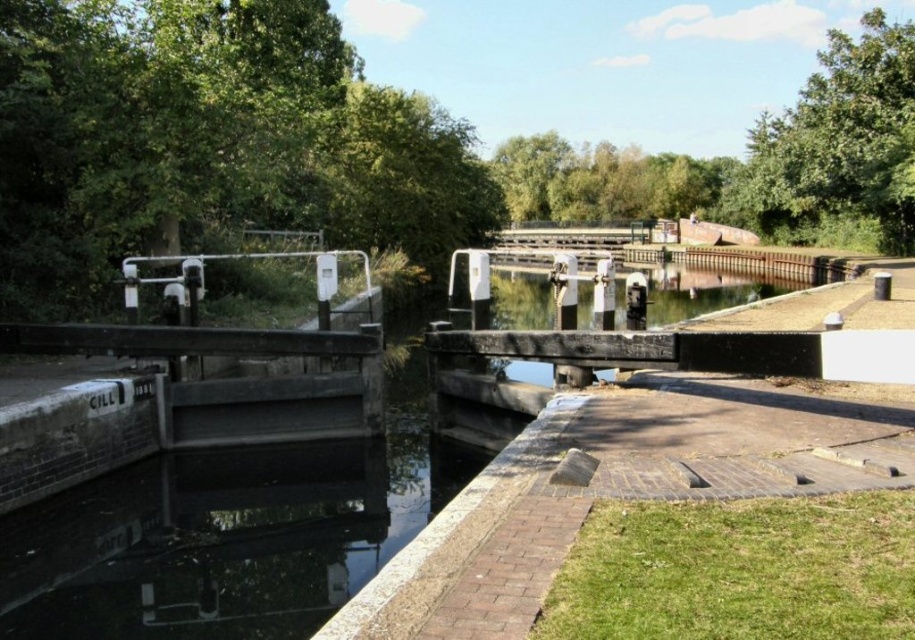
Image resolution: width=915 pixels, height=640 pixels. Identify the location of green leafy tree at upper left. (208, 141).

Which is in front, point (77, 292) or point (607, 193)?

Point (77, 292)

Is point (100, 51) farther from camera compared to point (494, 156)?

That is False.

Locate an element on the screen. This screenshot has width=915, height=640. green leafy tree at upper left is located at coordinates (208, 141).

Does green leafy tree at upper left appear under green leafy tree at upper right?

Yes, green leafy tree at upper left is below green leafy tree at upper right.

Can you confirm if green leafy tree at upper left is positioned to the left of green leafy tree at upper right?

Indeed, green leafy tree at upper left is positioned on the left side of green leafy tree at upper right.

Locate an element on the screen. green leafy tree at upper left is located at coordinates (208, 141).

Is green leafy tree at upper right to the right of green leafy tree at upper center from the viewer's perspective?

Yes, green leafy tree at upper right is to the right of green leafy tree at upper center.

Does green leafy tree at upper right appear over green leafy tree at upper center?

Indeed, green leafy tree at upper right is positioned over green leafy tree at upper center.

Image resolution: width=915 pixels, height=640 pixels. What do you see at coordinates (838, 148) in the screenshot?
I see `green leafy tree at upper right` at bounding box center [838, 148].

Identify the location of green leafy tree at upper right. (838, 148).